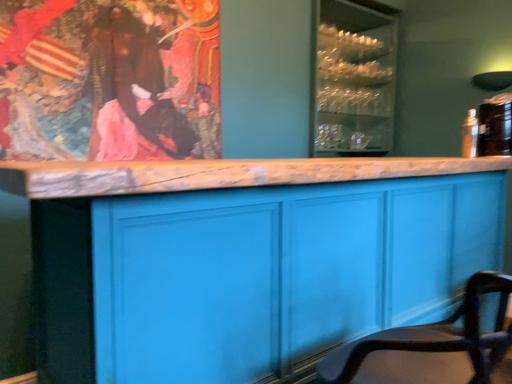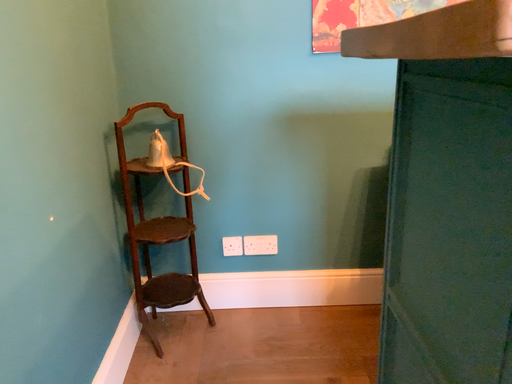
Question: How did the camera likely rotate when shooting the video?

Choices:
 (A) rotated upward
 (B) rotated downward

Answer: (B)